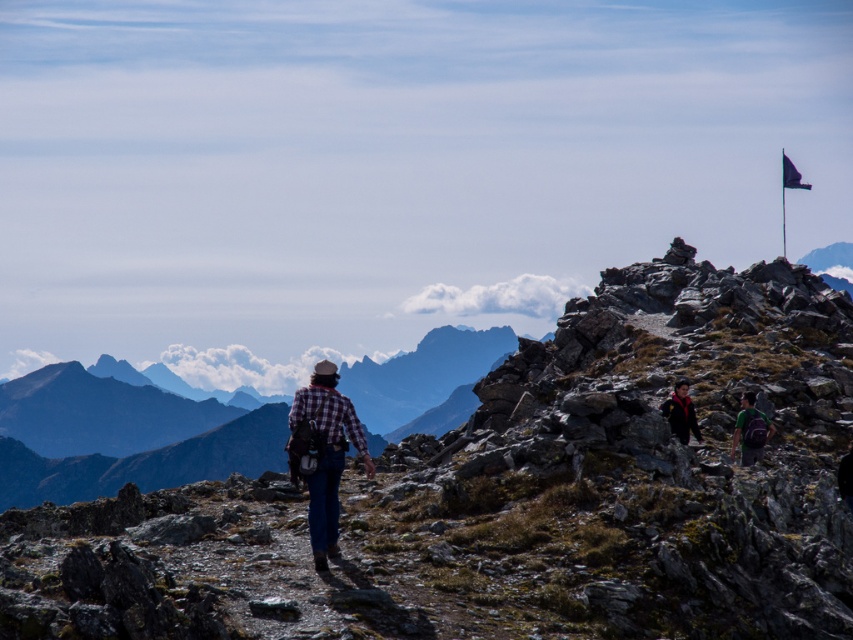
You are a hiker trying to decide whether to take a photo of the plaid fabric shirt at center and the black fabric flag at upper right together in the same frame. Based on their sizes, will both objects fit in the camera viewfinder without needing to zoom out?

The plaid fabric shirt at center has a lesser width compared to the black fabric flag at upper right. Since the shirt is smaller in width, both objects can likely fit within the camera viewfinder without needing to zoom out, provided their positions are within the frame.

You are standing at the point with coordinates point (793,164). You want to walk to the flagpole on the small rocky outcrop. There is an obstacle at point (323,490). Will you have to go around the obstacle to reach the flagpole?

Since point (323,490) is in front of point (793,164), the obstacle is blocking the path between you and the flagpole. Therefore, you will need to go around the obstacle to reach the flagpole.

You are standing at the starting point of the dirt path and see the plaid fabric shirt at center and the black fabric flag at upper right. Which object is closer to you?

The plaid fabric shirt at center is closer to you because it is positioned to the left of the black fabric flag at upper right, indicating it is in the foreground.